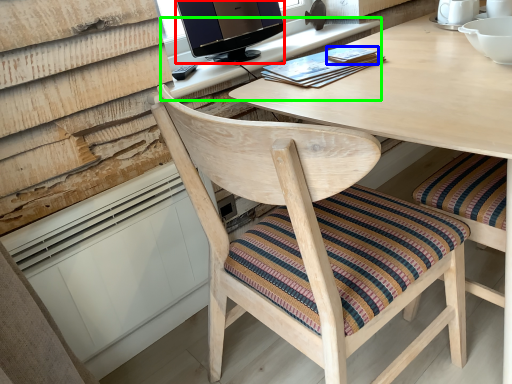
Question: Which is nearer to the television (highlighted by a red box)? book (highlighted by a blue box) or computer desk (highlighted by a green box).

Choices:
 (A) book
 (B) computer desk

Answer: (B)